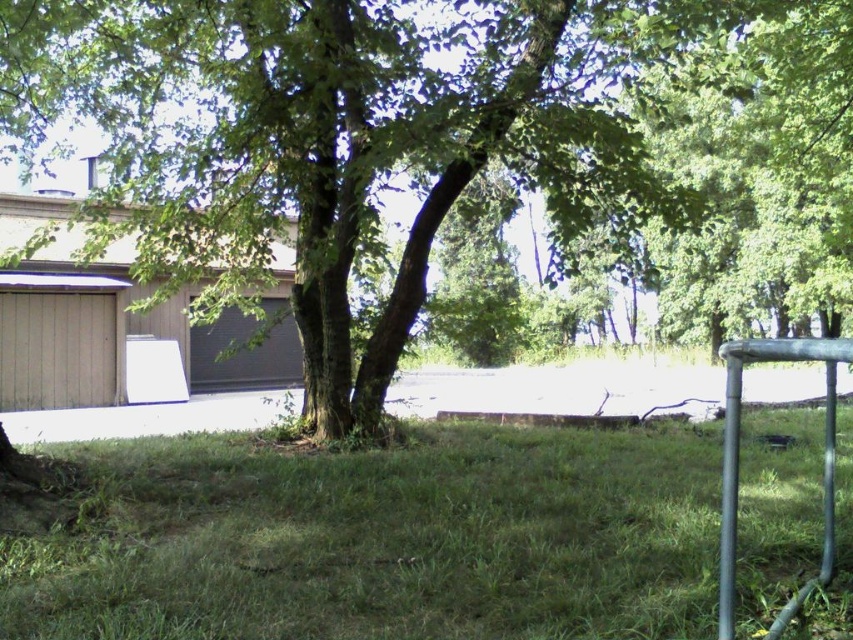
Which is more to the right, green leafy tree at center or metallic silver rail at lower right?

Positioned to the right is metallic silver rail at lower right.

Is green leafy tree at center above metallic silver rail at lower right?

Yes.

Between point (824, 256) and point (726, 524), which one is positioned in front?

Point (726, 524) is in front.

The height and width of the screenshot is (640, 853). Identify the location of green leafy tree at center. (442, 156).

Does green grassy at center have a lesser width compared to metallic silver rail at lower right?

Yes, green grassy at center is thinner than metallic silver rail at lower right.

Is point (583, 566) less distant than point (723, 612)?

No, (583, 566) is behind (723, 612).

Where is `green grassy at center`? Image resolution: width=853 pixels, height=640 pixels. green grassy at center is located at coordinates (384, 540).

The height and width of the screenshot is (640, 853). Identify the location of green grassy at center. (384, 540).

Can you confirm if green leafy tree at center is positioned to the right of green grassy at center?

Correct, you'll find green leafy tree at center to the right of green grassy at center.

Can you confirm if green leafy tree at center is thinner than green grassy at center?

Incorrect, green leafy tree at center's width is not less than green grassy at center's.

Who is more forward, (431, 301) or (437, 595)?

Point (437, 595) is more forward.

Where is `green leafy tree at center`? This screenshot has height=640, width=853. green leafy tree at center is located at coordinates tap(442, 156).